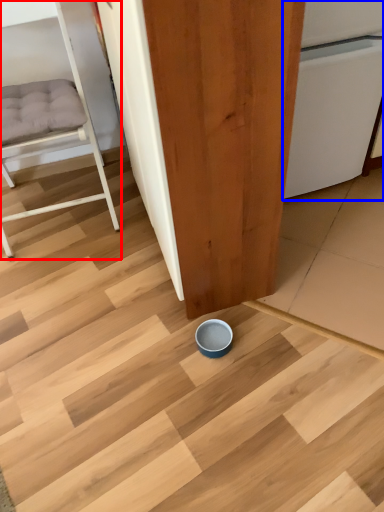
Question: Among these objects, which one is nearest to the camera, furniture (highlighted by a red box) or dish washer (highlighted by a blue box)?

Choices:
 (A) furniture
 (B) dish washer

Answer: (A)